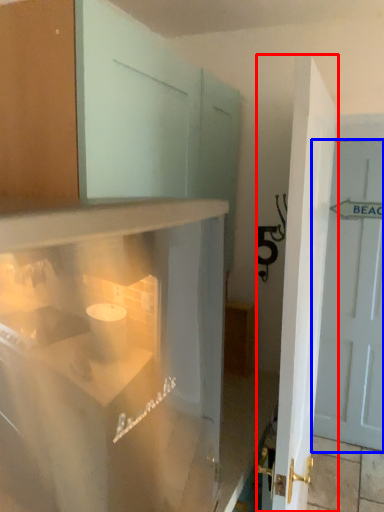
Question: Which of the following is the farthest to the observer, door (highlighted by a red box) or door (highlighted by a blue box)?

Choices:
 (A) door
 (B) door

Answer: (B)